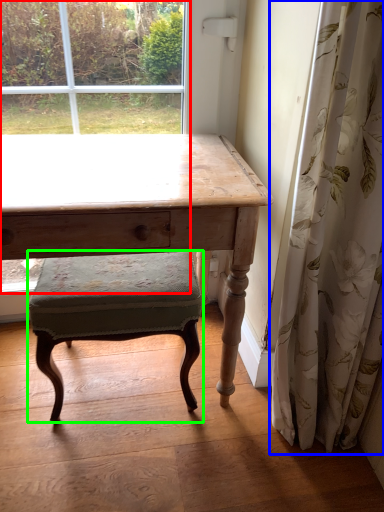
Question: Considering the real-world distances, which object is closest to bay window (highlighted by a red box)? curtain (highlighted by a blue box) or stool (highlighted by a green box).

Choices:
 (A) curtain
 (B) stool

Answer: (B)